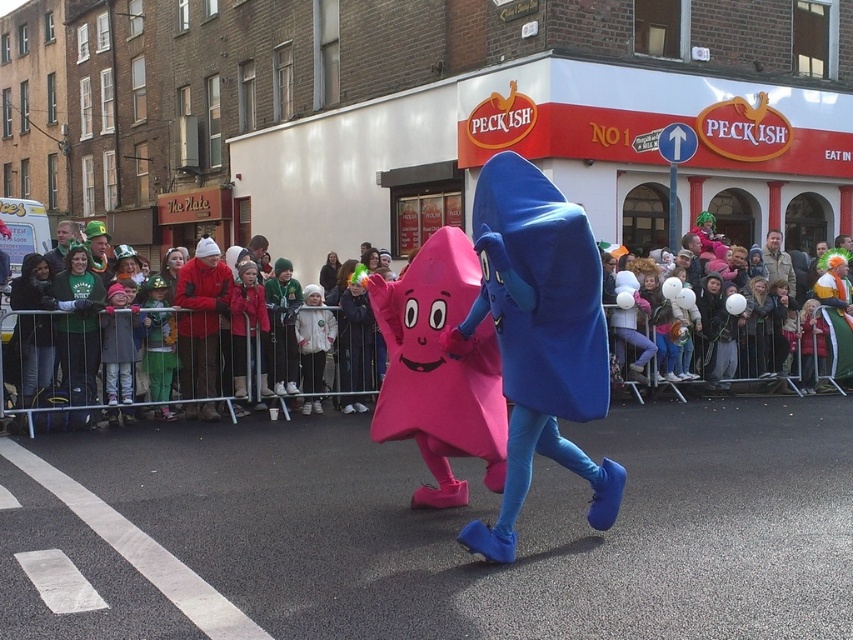
Question: Estimate the real-world distances between objects in this image. Which object is closer to the blue fabric costume at center?

Choices:
 (A) matte pink star at center
 (B) white fluffy balloons at center

Answer: (A)

Question: Which point is farther to the camera?

Choices:
 (A) (844, 346)
 (B) (524, 273)
 (C) (450, 400)
 (D) (227, 314)

Answer: (A)

Question: Does blue fabric costume at center appear on the left side of white fluffy balloons at center?

Choices:
 (A) yes
 (B) no

Answer: (A)

Question: Observing the image, what is the correct spatial positioning of matte pink star at center in reference to white fluffy balloons at center?

Choices:
 (A) left
 (B) right

Answer: (A)

Question: Which of the following is the closest to the observer?

Choices:
 (A) (88, 332)
 (B) (810, 308)
 (C) (810, 378)
 (D) (540, 224)

Answer: (D)

Question: Considering the relative positions of matte pink costume at center and matte pink star at center in the image provided, where is matte pink costume at center located with respect to matte pink star at center?

Choices:
 (A) above
 (B) below

Answer: (B)